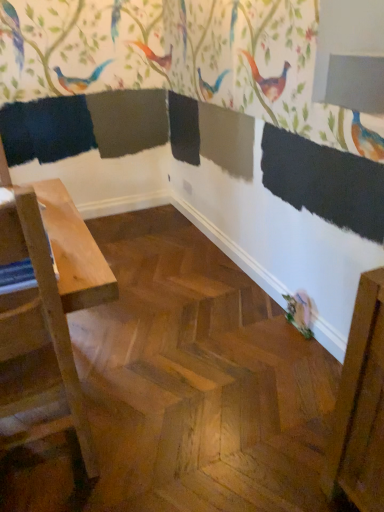
Question: From the image's perspective, does matte pink bird at lower right appear higher than light wood table at left?

Choices:
 (A) no
 (B) yes

Answer: (A)

Question: Is matte pink bird at lower right shorter than light wood table at left?

Choices:
 (A) no
 (B) yes

Answer: (B)

Question: Does matte pink bird at lower right lie behind light wood table at left?

Choices:
 (A) yes
 (B) no

Answer: (A)

Question: Is matte pink bird at lower right at the right side of light wood table at left?

Choices:
 (A) yes
 (B) no

Answer: (A)

Question: Is matte pink bird at lower right not near light wood table at left?

Choices:
 (A) yes
 (B) no

Answer: (A)

Question: Can light wood table at left be found inside matte pink bird at lower right?

Choices:
 (A) no
 (B) yes

Answer: (A)

Question: Is light wood table at left next to matte pink bird at lower right?

Choices:
 (A) yes
 (B) no

Answer: (B)

Question: From the image's perspective, would you say light wood table at left is positioned over matte pink bird at lower right?

Choices:
 (A) no
 (B) yes

Answer: (B)

Question: Considering the relative positions of light wood table at left and matte pink bird at lower right in the image provided, is light wood table at left to the left of matte pink bird at lower right from the viewer's perspective?

Choices:
 (A) no
 (B) yes

Answer: (B)

Question: Is light wood table at left located outside matte pink bird at lower right?

Choices:
 (A) no
 (B) yes

Answer: (B)

Question: Is light wood table at left turned away from matte pink bird at lower right?

Choices:
 (A) no
 (B) yes

Answer: (A)

Question: From a real-world perspective, is light wood table at left positioned over matte pink bird at lower right based on gravity?

Choices:
 (A) no
 (B) yes

Answer: (B)

Question: In terms of height, does matte pink bird at lower right look taller or shorter compared to light wood table at left?

Choices:
 (A) short
 (B) tall

Answer: (A)